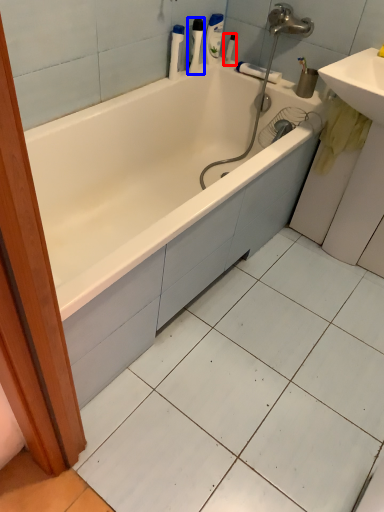
Question: Which object appears closest to the camera in this image, toiletry (highlighted by a red box) or toiletry (highlighted by a blue box)?

Choices:
 (A) toiletry
 (B) toiletry

Answer: (B)